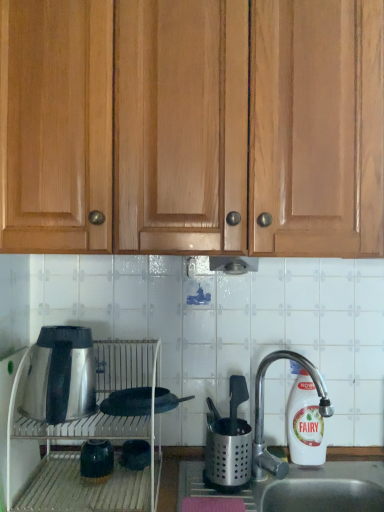
Question: Is satin silver oven at lower left at the back of silver metallic faucet at right?

Choices:
 (A) yes
 (B) no

Answer: (B)

Question: From the image's perspective, is silver metallic faucet at right on top of satin silver oven at lower left?

Choices:
 (A) yes
 (B) no

Answer: (A)

Question: Can you confirm if silver metallic faucet at right is wider than satin silver oven at lower left?

Choices:
 (A) yes
 (B) no

Answer: (B)

Question: Considering the relative positions of silver metallic faucet at right and satin silver oven at lower left in the image provided, is silver metallic faucet at right to the left of satin silver oven at lower left from the viewer's perspective?

Choices:
 (A) yes
 (B) no

Answer: (B)

Question: Is satin silver oven at lower left a part of silver metallic faucet at right?

Choices:
 (A) yes
 (B) no

Answer: (B)

Question: Does silver metallic faucet at right turn towards satin silver oven at lower left?

Choices:
 (A) no
 (B) yes

Answer: (A)

Question: Does satin silver oven at lower left lie in front of light brown wood cabinets at upper center?

Choices:
 (A) no
 (B) yes

Answer: (A)

Question: Does satin silver oven at lower left have a greater height compared to light brown wood cabinets at upper center?

Choices:
 (A) yes
 (B) no

Answer: (B)

Question: From a real-world perspective, is satin silver oven at lower left below light brown wood cabinets at upper center?

Choices:
 (A) no
 (B) yes

Answer: (B)

Question: Considering the relative positions of satin silver oven at lower left and light brown wood cabinets at upper center in the image provided, is satin silver oven at lower left to the right of light brown wood cabinets at upper center from the viewer's perspective?

Choices:
 (A) no
 (B) yes

Answer: (A)

Question: From the image's perspective, does satin silver oven at lower left appear higher than light brown wood cabinets at upper center?

Choices:
 (A) no
 (B) yes

Answer: (A)

Question: Are satin silver oven at lower left and light brown wood cabinets at upper center making contact?

Choices:
 (A) no
 (B) yes

Answer: (A)

Question: Considering the relative positions of matte green vase at lower left, the 2th appliance when ordered from bottom to top, and matte black pot at lower center, which is the 1th appliance in bottom-to-top order, in the image provided, is matte green vase at lower left, the 2th appliance when ordered from bottom to top, in front of matte black pot at lower center, which is the 1th appliance in bottom-to-top order,?

Choices:
 (A) yes
 (B) no

Answer: (A)